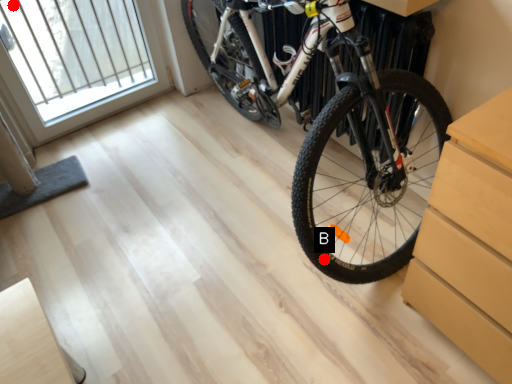
Question: Two points are circled on the image, labeled by A and B beside each circle. Which point is farther to the camera?

Choices:
 (A) A is further
 (B) B is further

Answer: (A)